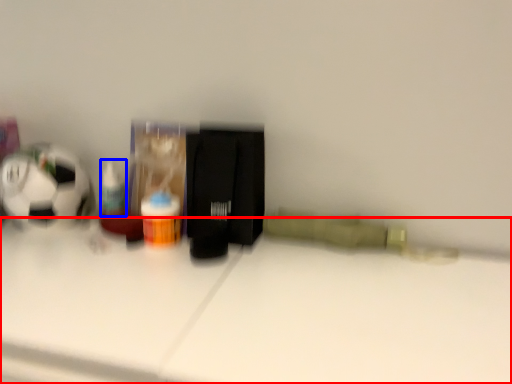
Question: Which object is closer to the camera taking this photo, table (highlighted by a red box) or toiletry (highlighted by a blue box)?

Choices:
 (A) table
 (B) toiletry

Answer: (A)